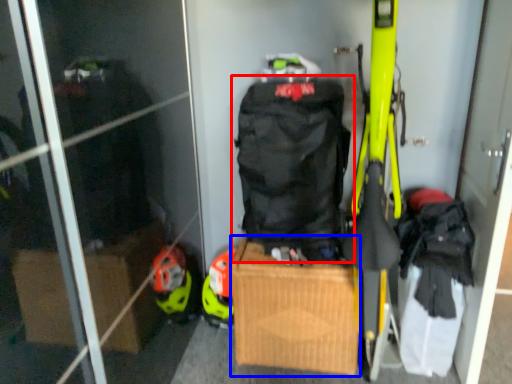
Question: Which object is further to the camera taking this photo, backpack (highlighted by a red box) or cardboard box (highlighted by a blue box)?

Choices:
 (A) backpack
 (B) cardboard box

Answer: (B)